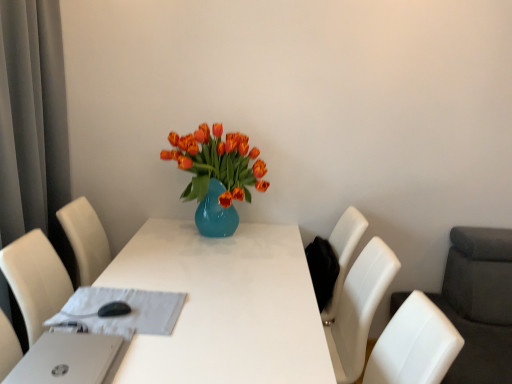
Identify the location of empty space that is ontop of white plastic laptop at lower left (from a real-world perspective). This screenshot has width=512, height=384. (62, 363).